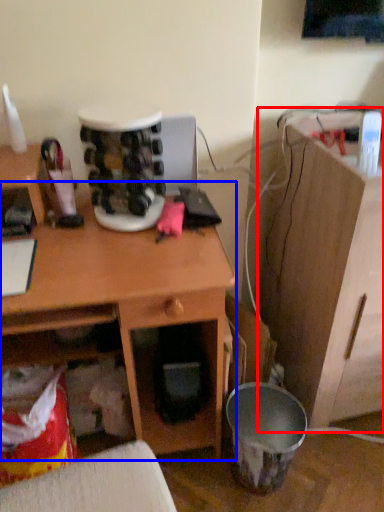
Question: Which object is further to the camera taking this photo, computer desk (highlighted by a red box) or desk (highlighted by a blue box)?

Choices:
 (A) computer desk
 (B) desk

Answer: (A)